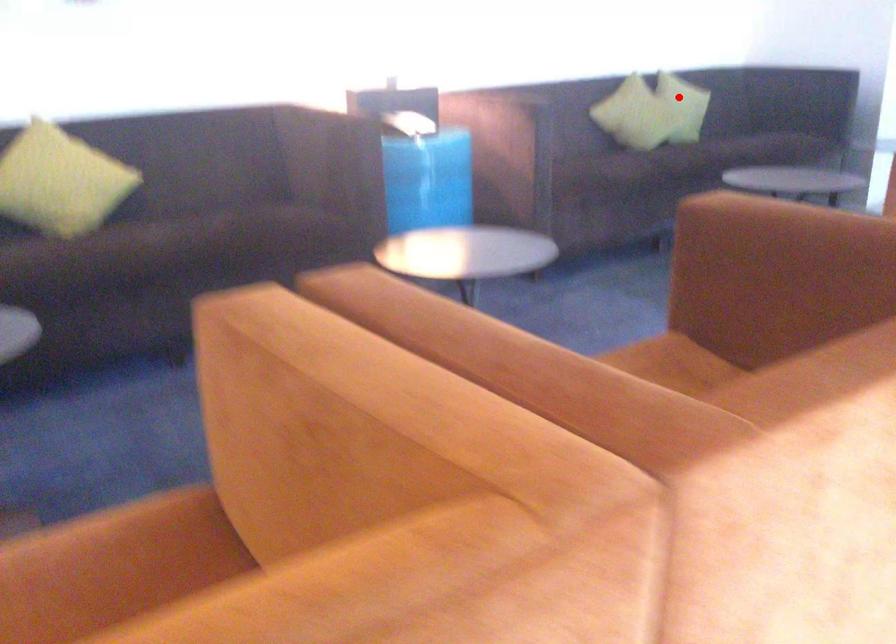
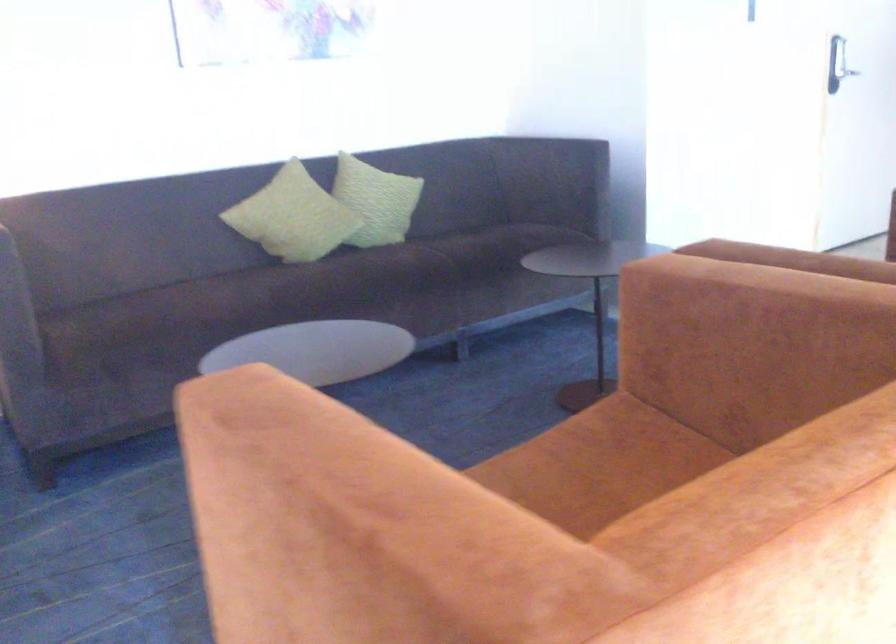
In the second image, find the point that corresponds to the highlighted location in the first image.

(293, 216)